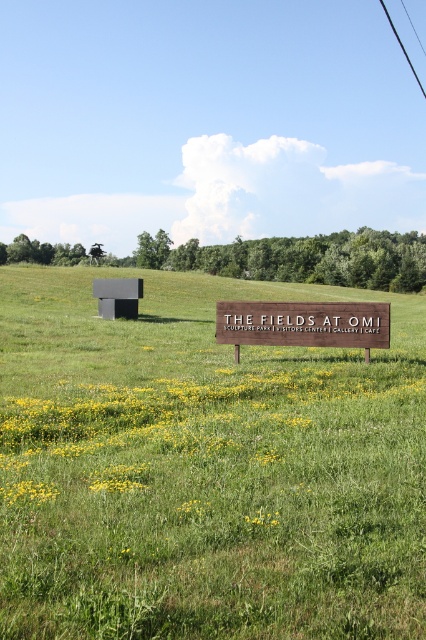
Question: Does black matte sculpture at upper left appear on the right side of wooden sign at center?

Choices:
 (A) no
 (B) yes

Answer: (B)

Question: Which object appears farthest from the camera in this image?

Choices:
 (A) black matte sculpture at upper left
 (B) wooden sign at center

Answer: (B)

Question: Among these objects, which one is farthest from the camera?

Choices:
 (A) black matte sculpture at upper left
 (B) wooden sign at center

Answer: (B)

Question: Can you confirm if black matte sculpture at upper left is bigger than wooden sign at center?

Choices:
 (A) no
 (B) yes

Answer: (B)

Question: Can you confirm if black matte sculpture at upper left is bigger than wooden sign at center?

Choices:
 (A) no
 (B) yes

Answer: (B)

Question: Which object appears farthest from the camera in this image?

Choices:
 (A) black matte sculpture at upper left
 (B) wooden sign at center

Answer: (B)